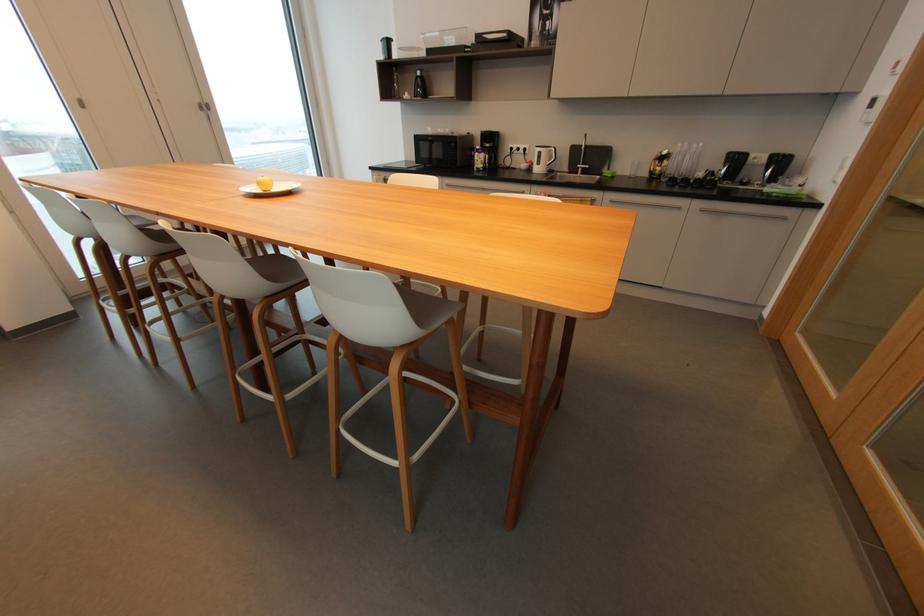
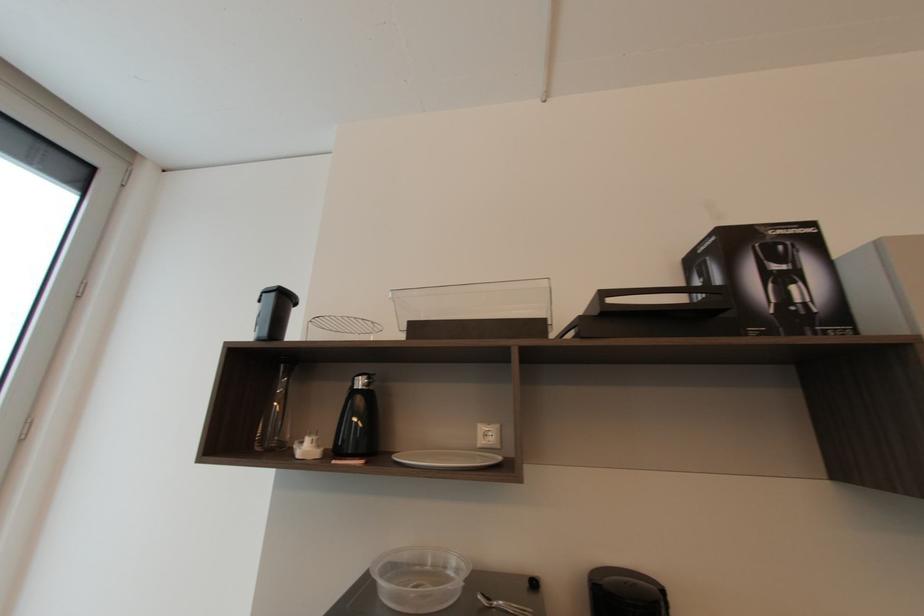
Where in the second image is the point corresponding to [421,74] from the first image?

(362, 384)